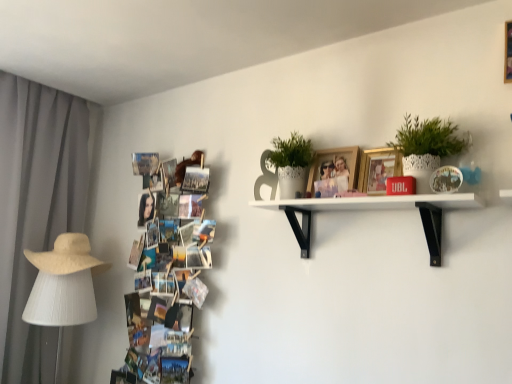
Question: Does point (14, 297) appear closer or farther from the camera than point (55, 278)?

Choices:
 (A) farther
 (B) closer

Answer: (A)

Question: Is gray fabric curtain at left inside or outside of white fabric lampshade at left?

Choices:
 (A) inside
 (B) outside

Answer: (B)

Question: Based on their relative distances, which object is farther from the gray fabric curtain at left?

Choices:
 (A) beige straw hat at left
 (B) gold metallic picture frame at upper center, the first picture frame when ordered from right to left
 (C) white matte shelf at upper center
 (D) white textured pot at upper right, acting as the 1th houseplant starting from the right
 (E) white fabric lampshade at left

Answer: (D)

Question: Considering the real-world distances, which object is closest to the white matte shelf at upper center?

Choices:
 (A) white textured pot at upper right, the first houseplant viewed from the front
 (B) gold metallic picture frame at upper center, the first picture frame when ordered from right to left
 (C) beige straw hat at left
 (D) gray fabric curtain at left
 (E) printed paper collage at left

Answer: (B)